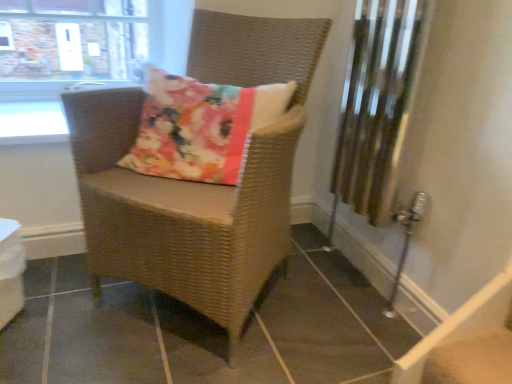
Question: Considering the relative sizes of white glossy table at lower left and woven brown chair at center in the image provided, is white glossy table at lower left wider than woven brown chair at center?

Choices:
 (A) no
 (B) yes

Answer: (A)

Question: Does white glossy table at lower left have a lesser height compared to woven brown chair at center?

Choices:
 (A) yes
 (B) no

Answer: (A)

Question: Would you say white glossy table at lower left is a long distance from woven brown chair at center?

Choices:
 (A) yes
 (B) no

Answer: (B)

Question: Is white glossy table at lower left next to woven brown chair at center and touching it?

Choices:
 (A) yes
 (B) no

Answer: (B)

Question: Is white glossy table at lower left positioned before woven brown chair at center?

Choices:
 (A) no
 (B) yes

Answer: (A)

Question: Can you confirm if white glossy table at lower left is thinner than woven brown chair at center?

Choices:
 (A) yes
 (B) no

Answer: (A)

Question: Does clear glass window at upper left have a larger size compared to woven brown chair at center?

Choices:
 (A) no
 (B) yes

Answer: (A)

Question: From the image's perspective, is clear glass window at upper left on top of woven brown chair at center?

Choices:
 (A) no
 (B) yes

Answer: (B)

Question: Could woven brown chair at center be considered to be inside clear glass window at upper left?

Choices:
 (A) no
 (B) yes

Answer: (A)

Question: Is clear glass window at upper left oriented away from woven brown chair at center?

Choices:
 (A) no
 (B) yes

Answer: (A)

Question: Is clear glass window at upper left at the left side of woven brown chair at center?

Choices:
 (A) no
 (B) yes

Answer: (B)

Question: Is clear glass window at upper left wider than woven brown chair at center?

Choices:
 (A) no
 (B) yes

Answer: (A)

Question: Can you confirm if woven brown chair at center is positioned to the left of clear glass window at upper left?

Choices:
 (A) yes
 (B) no

Answer: (B)